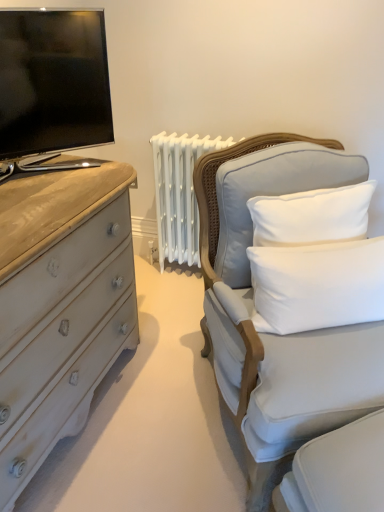
Question: Considering their positions, is white soft cushion at right, arranged as the 1th pillow when ordered from the bottom, located in front of or behind white cotton pillow at upper right, the 1th pillow positioned from the top?

Choices:
 (A) front
 (B) behind

Answer: (A)

Question: From a real-world perspective, is white soft cushion at right, the second pillow when ordered from top to bottom, positioned above or below white cotton pillow at upper right, the 1th pillow positioned from the top?

Choices:
 (A) below
 (B) above

Answer: (A)

Question: Estimate the real-world distances between objects in this image. Which object is farther from the white cotton pillow at upper right, the 1th pillow positioned from the top?

Choices:
 (A) light gray fabric chair at right
 (B) white soft cushion at right, the second pillow when ordered from top to bottom
 (C) matte black screen at upper left

Answer: (C)

Question: Based on their relative distances, which object is farther from the matte black screen at upper left?

Choices:
 (A) light gray fabric chair at right
 (B) white soft cushion at right, arranged as the 1th pillow when ordered from the bottom
 (C) white cotton pillow at upper right, the 1th pillow positioned from the top

Answer: (B)